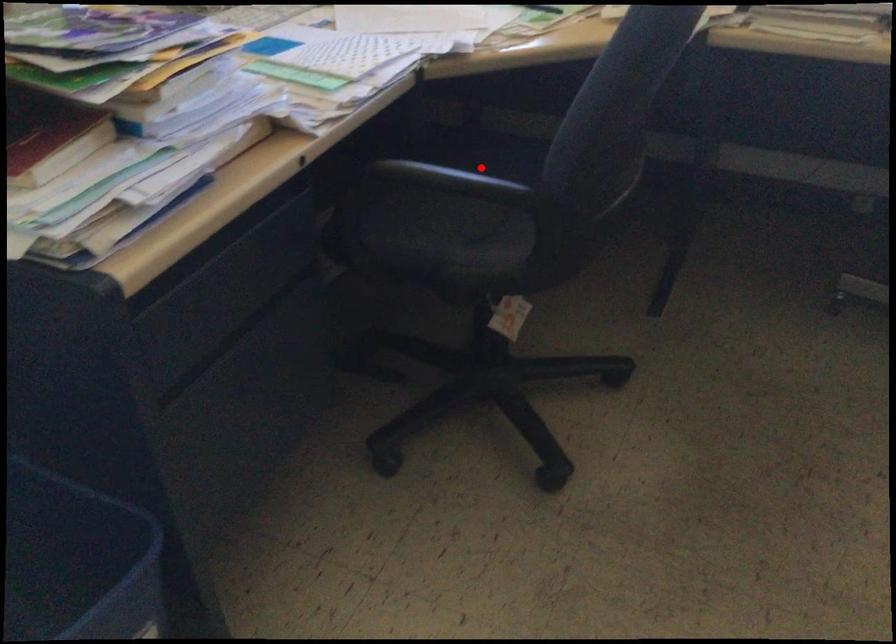
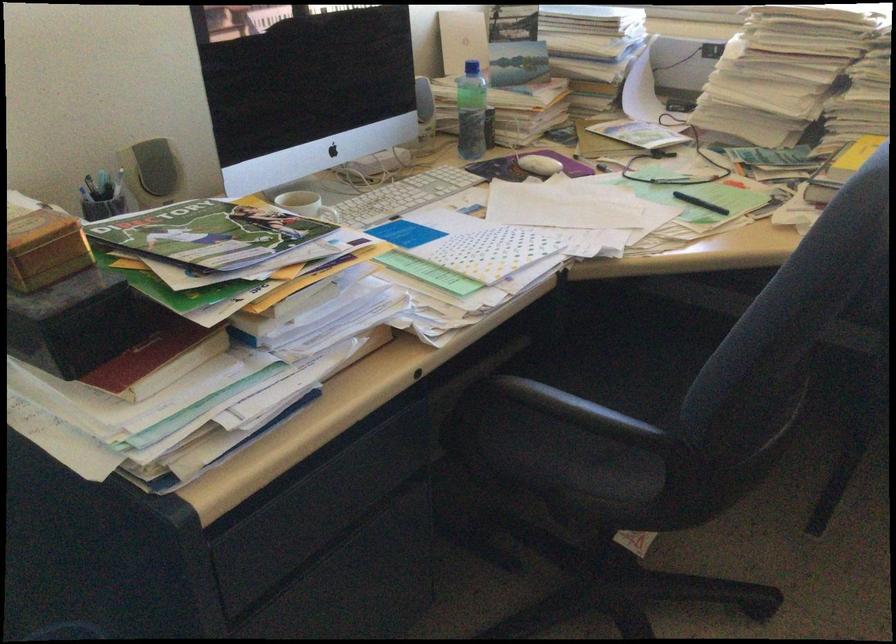
Find the pixel in the second image that matches the highlighted location in the first image.

(618, 365)